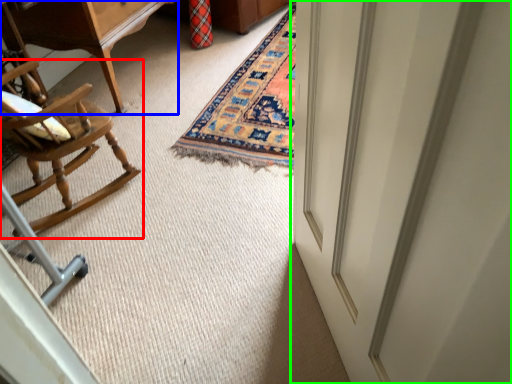
Question: Based on their relative distances, which object is nearer to chair (highlighted by a red box)? Choose from table (highlighted by a blue box) and door (highlighted by a green box).

Choices:
 (A) table
 (B) door

Answer: (A)